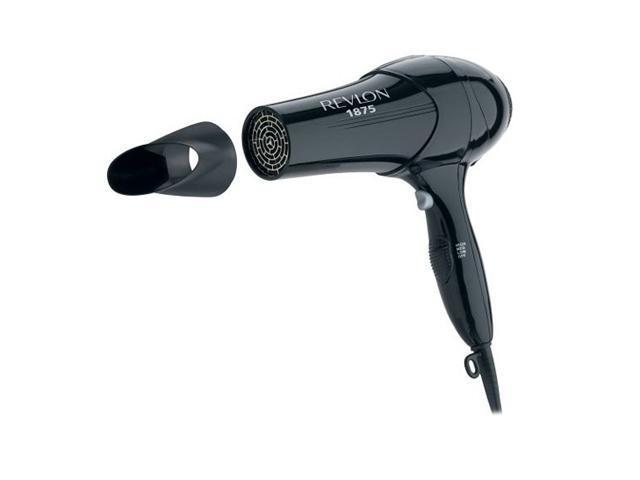
Locate an element on the screen. Image resolution: width=640 pixels, height=480 pixels. black hair dryer is located at coordinates (449, 112).